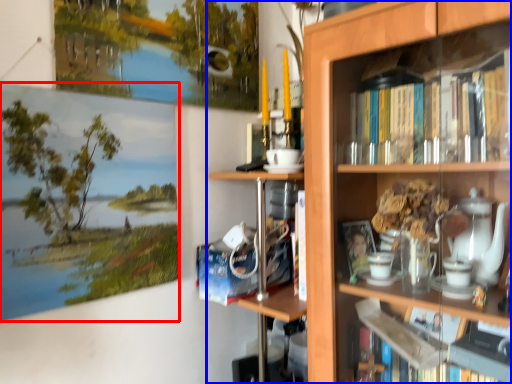
Question: Among these objects, which one is nearest to the camera, picture frame (highlighted by a red box) or bookcase (highlighted by a blue box)?

Choices:
 (A) picture frame
 (B) bookcase

Answer: (B)